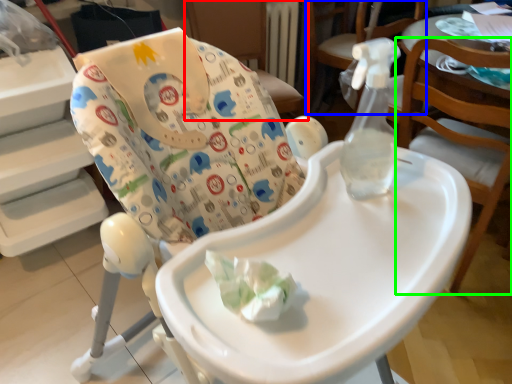
Question: Based on their relative distances, which object is nearer to chair (highlighted by a red box)? Choose from chair (highlighted by a blue box) and chair (highlighted by a green box).

Choices:
 (A) chair
 (B) chair

Answer: (A)